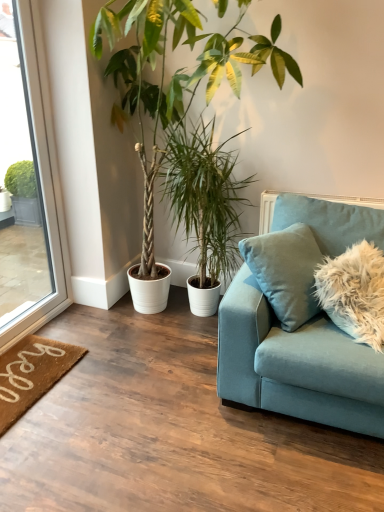
Describe the element at coordinates (205, 206) in the screenshot. I see `green leafy plant at center, the first houseplant positioned from the right` at that location.

Identify the location of green leafy plant at center, the first houseplant positioned from the right. This screenshot has height=512, width=384. (205, 206).

Which is behind, green leafy plant at center, the first houseplant positioned from the right, or teal velvet couch at right?

green leafy plant at center, the first houseplant positioned from the right, is more distant.

Which point is more forward, (214, 157) or (342, 240)?

The point (342, 240) is more forward.

From a real-world perspective, between green leafy plant at center, the first houseplant positioned from the right, and teal velvet couch at right, who is vertically lower?

In real-world perspective, teal velvet couch at right is lower.

Are green leafy plant at center, placed as the 2th houseplant when sorted from left to right, and teal velvet couch at right far apart?

No, there isn't a large distance between green leafy plant at center, placed as the 2th houseplant when sorted from left to right, and teal velvet couch at right.

From the image's perspective, is brown coir doormat at lower left located above or below green leafy plant at upper left, positioned as the second houseplant in right-to-left order?

Clearly, from the image's perspective, brown coir doormat at lower left is below green leafy plant at upper left, positioned as the second houseplant in right-to-left order.

Is green leafy plant at upper left, the first houseplant when ordered from left to right, completely or partially inside brown coir doormat at lower left?

Definitely not — green leafy plant at upper left, the first houseplant when ordered from left to right, is not inside brown coir doormat at lower left.

Can you tell me how much brown coir doormat at lower left and green leafy plant at upper left, positioned as the second houseplant in right-to-left order, differ in facing direction?

89.7 degrees.

In terms of width, does brown coir doormat at lower left look wider or thinner when compared to green leafy plant at upper left, positioned as the second houseplant in right-to-left order?

brown coir doormat at lower left is thinner than green leafy plant at upper left, positioned as the second houseplant in right-to-left order.

Considering the positions of objects brown coir doormat at lower left and green leafy plant at center, the first houseplant positioned from the right, in the image provided, who is in front, brown coir doormat at lower left or green leafy plant at center, the first houseplant positioned from the right,?

brown coir doormat at lower left is in front.

Is brown coir doormat at lower left to the right of green leafy plant at center, the first houseplant positioned from the right, from the viewer's perspective?

In fact, brown coir doormat at lower left is to the left of green leafy plant at center, the first houseplant positioned from the right.

Does point (35, 388) lie behind point (198, 194)?

No, it is not.

From a real-world perspective, is brown coir doormat at lower left physically below green leafy plant at center, placed as the 2th houseplant when sorted from left to right?

Yes.

From the picture: Can you tell me how much green leafy plant at upper left, the first houseplant when ordered from left to right, and teal velvet couch at right differ in facing direction?

The angle between the facing direction of green leafy plant at upper left, the first houseplant when ordered from left to right, and the facing direction of teal velvet couch at right is 1.93 degrees.

Is the surface of green leafy plant at upper left, the first houseplant when ordered from left to right, in direct contact with teal velvet couch at right?

No, green leafy plant at upper left, the first houseplant when ordered from left to right, is not next to teal velvet couch at right.

Considering the sizes of objects green leafy plant at upper left, the first houseplant when ordered from left to right, and teal velvet couch at right in the image provided, who is taller, green leafy plant at upper left, the first houseplant when ordered from left to right, or teal velvet couch at right?

With more height is green leafy plant at upper left, the first houseplant when ordered from left to right.

Can you confirm if green leafy plant at upper left, positioned as the second houseplant in right-to-left order, is bigger than teal velvet couch at right?

Indeed, green leafy plant at upper left, positioned as the second houseplant in right-to-left order, has a larger size compared to teal velvet couch at right.

Visually, is clear glass window at left positioned to the left or to the right of fluffy light brown pillow at right?

clear glass window at left is to the left of fluffy light brown pillow at right.

From the image's perspective, is clear glass window at left on top of fluffy light brown pillow at right?

Correct, clear glass window at left appears higher than fluffy light brown pillow at right in the image.

Which of these two, clear glass window at left or fluffy light brown pillow at right, is thinner?

clear glass window at left is thinner.

I want to click on pillow below the clear glass window at left (from the image's perspective), so click(x=354, y=292).

From the image's perspective, would you say green leafy plant at center, placed as the 2th houseplant when sorted from left to right, is positioned over brown coir doormat at lower left?

Yes, from the image's perspective, green leafy plant at center, placed as the 2th houseplant when sorted from left to right, is above brown coir doormat at lower left.

Measure the distance from green leafy plant at center, placed as the 2th houseplant when sorted from left to right, to brown coir doormat at lower left.

The distance of green leafy plant at center, placed as the 2th houseplant when sorted from left to right, from brown coir doormat at lower left is 3.62 feet.

Considering the relative sizes of green leafy plant at center, placed as the 2th houseplant when sorted from left to right, and brown coir doormat at lower left in the image provided, is green leafy plant at center, placed as the 2th houseplant when sorted from left to right, taller than brown coir doormat at lower left?

Correct, green leafy plant at center, placed as the 2th houseplant when sorted from left to right, is much taller as brown coir doormat at lower left.

Is brown coir doormat at lower left located within green leafy plant at center, the first houseplant positioned from the right?

Actually, brown coir doormat at lower left is outside green leafy plant at center, the first houseplant positioned from the right.

Which of these two, green leafy plant at upper left, the first houseplant when ordered from left to right, or fluffy light brown pillow at right, is thinner?

fluffy light brown pillow at right is thinner.

Are green leafy plant at upper left, the first houseplant when ordered from left to right, and fluffy light brown pillow at right located far from each other?

Yes, green leafy plant at upper left, the first houseplant when ordered from left to right, is far from fluffy light brown pillow at right.

Is green leafy plant at upper left, the first houseplant when ordered from left to right, taller or shorter than fluffy light brown pillow at right?

Considering their sizes, green leafy plant at upper left, the first houseplant when ordered from left to right, has more height than fluffy light brown pillow at right.

In the scene shown: From a real-world perspective, is green leafy plant at upper left, positioned as the second houseplant in right-to-left order, located beneath fluffy light brown pillow at right?

No, from a real-world perspective, green leafy plant at upper left, positioned as the second houseplant in right-to-left order, is not beneath fluffy light brown pillow at right.

Image resolution: width=384 pixels, height=512 pixels. In order to click on studio couch located below the green leafy plant at center, the first houseplant positioned from the right (from the image's perspective) in this screenshot , I will do `click(295, 364)`.

At what (x,y) coordinates should I click in order to perform the action: click on doormat lying behind the green leafy plant at upper left, the first houseplant when ordered from left to right. Please return your answer as a coordinate pair (x, y). The image size is (384, 512). Looking at the image, I should click on (31, 374).

Which object lies nearer to the anchor point brown coir doormat at lower left, green leafy plant at center, the first houseplant positioned from the right, or teal velvet couch at right?

teal velvet couch at right is closer to brown coir doormat at lower left.

Which object lies further to the anchor point green leafy plant at upper left, the first houseplant when ordered from left to right, clear glass window at left or green leafy plant at center, the first houseplant positioned from the right?

Among the two, clear glass window at left is located further to green leafy plant at upper left, the first houseplant when ordered from left to right.

From the image, which object appears to be nearer to teal velvet couch at right, brown coir doormat at lower left or clear glass window at left?

brown coir doormat at lower left is closer to teal velvet couch at right.

From the image, which object appears to be nearer to green leafy plant at upper left, positioned as the second houseplant in right-to-left order, fluffy light brown pillow at right or teal velvet couch at right?

teal velvet couch at right lies closer to green leafy plant at upper left, positioned as the second houseplant in right-to-left order, than the other object.

Looking at the image, which one is located further to green leafy plant at center, placed as the 2th houseplant when sorted from left to right, brown coir doormat at lower left or fluffy light brown pillow at right?

Based on the image, brown coir doormat at lower left appears to be further to green leafy plant at center, placed as the 2th houseplant when sorted from left to right.

Based on their spatial positions, is green leafy plant at center, the first houseplant positioned from the right, or brown coir doormat at lower left closer to green leafy plant at upper left, the first houseplant when ordered from left to right?

green leafy plant at center, the first houseplant positioned from the right.

Based on their spatial positions, is brown coir doormat at lower left or green leafy plant at center, placed as the 2th houseplant when sorted from left to right, closer to teal velvet couch at right?

green leafy plant at center, placed as the 2th houseplant when sorted from left to right.

Considering their positions, is brown coir doormat at lower left positioned further to green leafy plant at upper left, positioned as the second houseplant in right-to-left order, than fluffy light brown pillow at right?

Based on the image, brown coir doormat at lower left appears to be further to green leafy plant at upper left, positioned as the second houseplant in right-to-left order.

The width and height of the screenshot is (384, 512). Find the location of `studio couch situated between clear glass window at left and fluffy light brown pillow at right from left to right`. studio couch situated between clear glass window at left and fluffy light brown pillow at right from left to right is located at coordinates coord(295,364).

I want to click on studio couch between green leafy plant at center, the first houseplant positioned from the right, and fluffy light brown pillow at right, in the horizontal direction, so click(x=295, y=364).

Where is `houseplant between teal velvet couch at right and green leafy plant at center, placed as the 2th houseplant when sorted from left to right, along the z-axis`? houseplant between teal velvet couch at right and green leafy plant at center, placed as the 2th houseplant when sorted from left to right, along the z-axis is located at coordinates point(185,118).

Where is `studio couch between green leafy plant at upper left, positioned as the second houseplant in right-to-left order, and fluffy light brown pillow at right from left to right`? Image resolution: width=384 pixels, height=512 pixels. studio couch between green leafy plant at upper left, positioned as the second houseplant in right-to-left order, and fluffy light brown pillow at right from left to right is located at coordinates (295, 364).